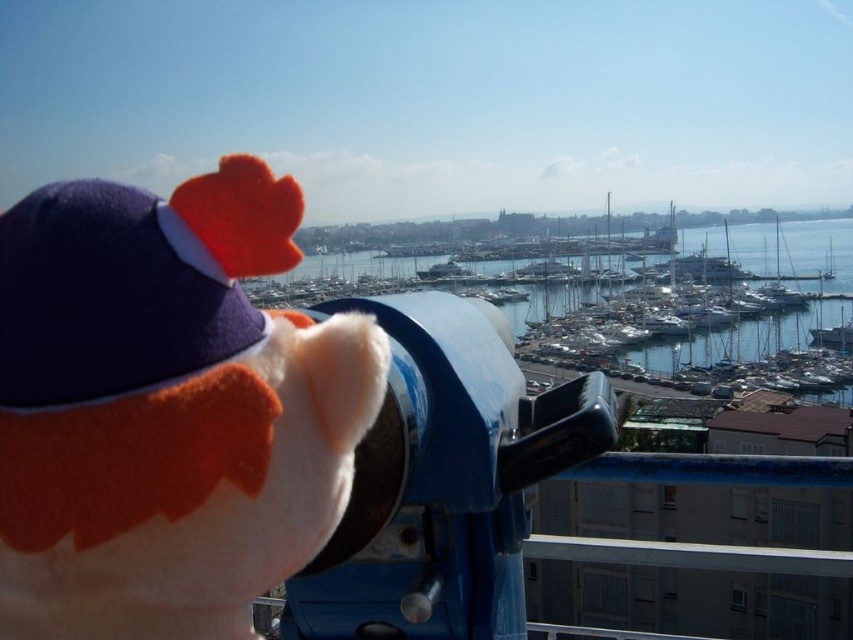
Is white plush toy at center shorter than blue water at center?

Correct, white plush toy at center is not as tall as blue water at center.

Does point (15, 461) lie behind point (737, 257)?

No, it is in front of (737, 257).

In order to click on white plush toy at center in this screenshot , I will do `click(165, 408)`.

Does white plush toy at center appear under blue metallic telescope at center?

Incorrect, white plush toy at center is not positioned below blue metallic telescope at center.

Who is lower down, white plush toy at center or blue metallic telescope at center?

blue metallic telescope at center

Where is `white plush toy at center`? The height and width of the screenshot is (640, 853). white plush toy at center is located at coordinates (165, 408).

Is point (502, 460) closer to camera compared to point (689, 340)?

Yes.

Who is more distant from viewer, (500, 358) or (814, 282)?

The point (814, 282) is behind.

Is point (447, 323) in front of point (738, 339)?

Yes, point (447, 323) is in front of point (738, 339).

Locate an element on the screen. This screenshot has height=640, width=853. blue metallic telescope at center is located at coordinates (444, 481).